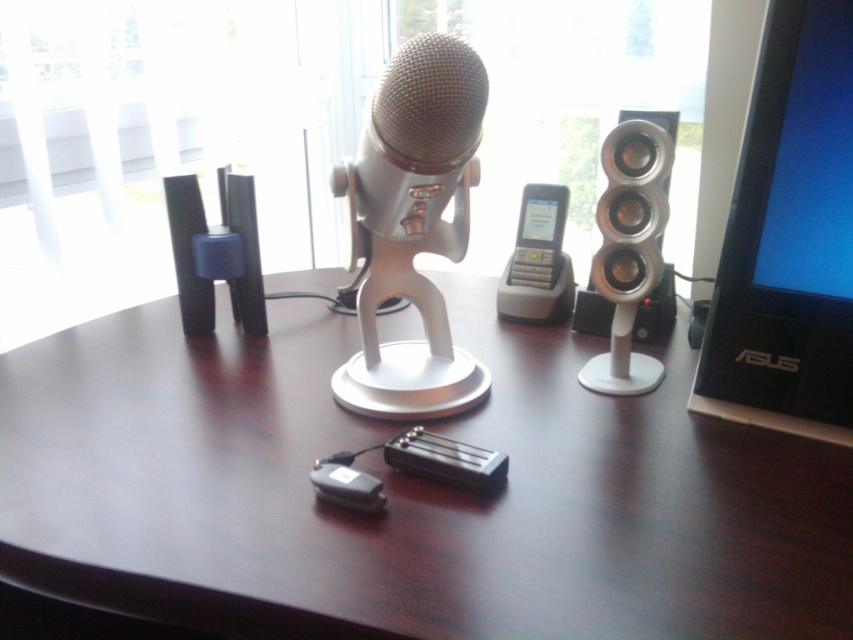
You are setting up a new monitor and speaker on your desk. The black plastic monitor at upper right needs to be placed next to the black plastic speaker at left. Based on their sizes, can the monitor fit horizontally next to the speaker without overlapping?

The black plastic monitor at upper right might be wider than the black plastic speaker at left, so there is a possibility that the monitor could fit horizontally next to the speaker without overlapping, but it depends on the exact dimensions.

You are setting up a new desk and want to place both the dark wood table at center and the black plastic speaker at left. Given their sizes, which one should you place first to ensure they both fit on the desk?

The dark wood table at center is larger in size than the black plastic speaker at left, so you should place the dark wood table at center first to ensure there is enough space for both items.

You are setting up a new audio system on the desk. You have a silver metallic microphone at center and need to place it precisely. According to the coordinates provided, where exactly should you position the microphone?

The silver metallic microphone at center should be positioned at coordinates point (413, 227) as specified.